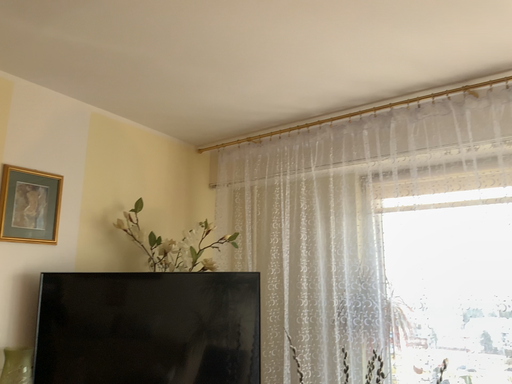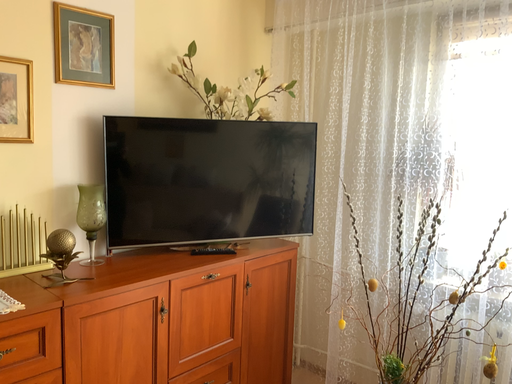
Question: Which way did the camera rotate in the video?

Choices:
 (A) rotated upward
 (B) rotated downward

Answer: (B)